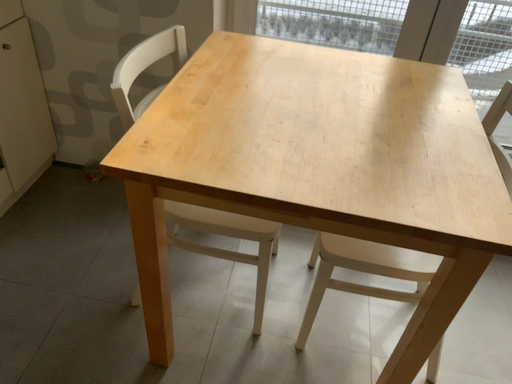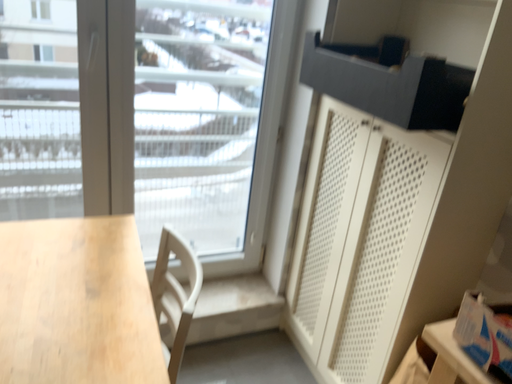
Question: How did the camera likely rotate when shooting the video?

Choices:
 (A) rotated downward
 (B) rotated upward

Answer: (B)